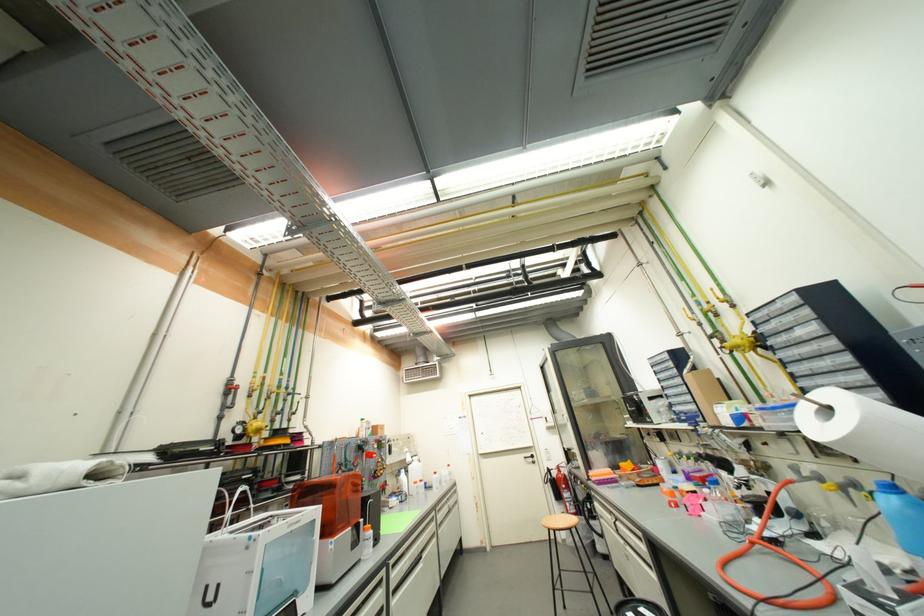
Find where to squeez the white spray bottle. Please return your answer as a coordinate pair (x, y).

(415, 476)